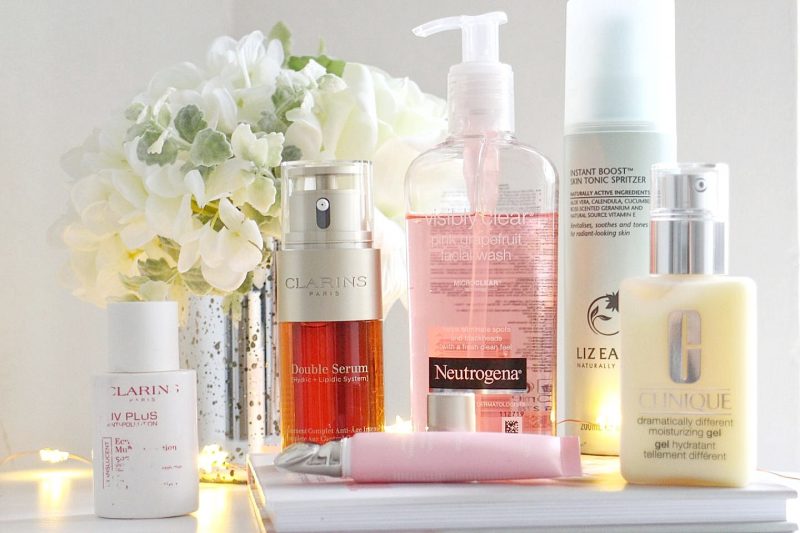
This screenshot has width=800, height=533. I want to click on table, so click(x=182, y=524).